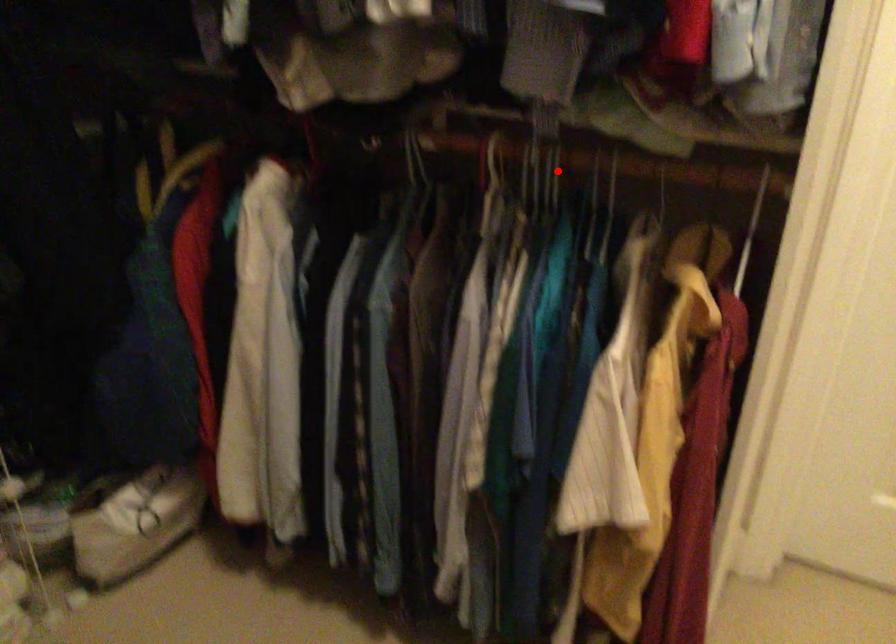
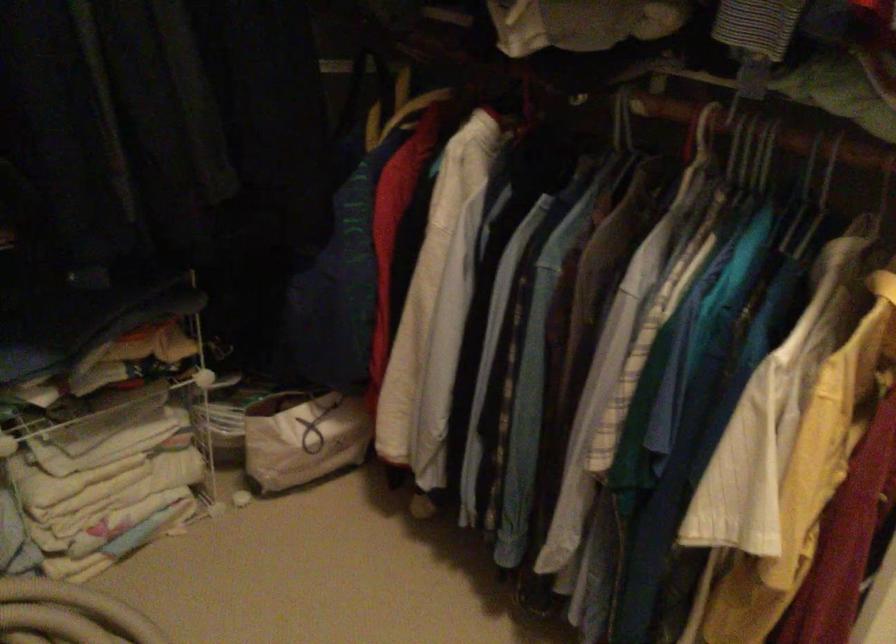
Question: I am providing you with two images of the same scene from different viewpoints. In image1, a red point is highlighted. Considering the same 3D point in image2, which of the following is correct?

Choices:
 (A) It is closer
 (B) It is farther

Answer: (A)